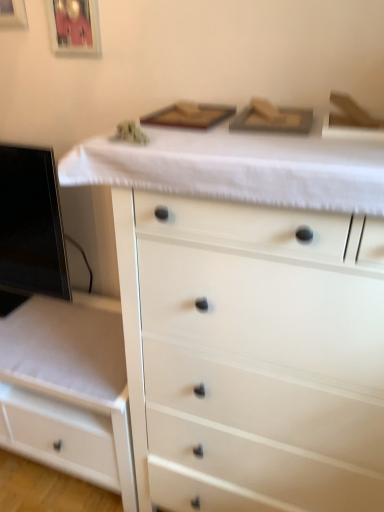
Question: From the image's perspective, is metallic silver picture frame at upper left, which appears as the 2th picture frame when viewed from the right, beneath white matte chest of drawers at center, which is counted as the 1th chest of drawers, starting from the right?

Choices:
 (A) yes
 (B) no

Answer: (B)

Question: Is metallic silver picture frame at upper left, the first picture frame when ordered from left to right, further to the viewer compared to white matte chest of drawers at center, the second chest of drawers when ordered from left to right?

Choices:
 (A) yes
 (B) no

Answer: (A)

Question: Is metallic silver picture frame at upper left, which appears as the 2th picture frame when viewed from the right, positioned with its back to white matte chest of drawers at center, which is counted as the 1th chest of drawers, starting from the right?

Choices:
 (A) yes
 (B) no

Answer: (B)

Question: Does metallic silver picture frame at upper left, which appears as the 2th picture frame when viewed from the right, appear on the right side of white matte chest of drawers at center, which is counted as the 1th chest of drawers, starting from the right?

Choices:
 (A) no
 (B) yes

Answer: (A)

Question: Is the surface of metallic silver picture frame at upper left, the first picture frame when ordered from left to right, in direct contact with white matte chest of drawers at center, which is counted as the 1th chest of drawers, starting from the right?

Choices:
 (A) no
 (B) yes

Answer: (A)

Question: Looking at the image, does white fabric at upper center seem bigger or smaller compared to white glossy drawer at lower left, which is the first chest of drawers from left to right?

Choices:
 (A) big
 (B) small

Answer: (B)

Question: Does point (104, 166) appear closer or farther from the camera than point (87, 464)?

Choices:
 (A) closer
 (B) farther

Answer: (A)

Question: Is white fabric at upper center inside the boundaries of white glossy drawer at lower left, which is the first chest of drawers from left to right, or outside?

Choices:
 (A) outside
 (B) inside

Answer: (A)

Question: Is white fabric at upper center wider or thinner than white glossy drawer at lower left, which is the first chest of drawers from left to right?

Choices:
 (A) thin
 (B) wide

Answer: (B)

Question: Based on their positions, is white matte chest of drawers at center, which is counted as the 1th chest of drawers, starting from the right, located to the left or right of black glossy computer monitor at left?

Choices:
 (A) left
 (B) right

Answer: (B)

Question: From a real-world perspective, relative to black glossy computer monitor at left, is white matte chest of drawers at center, which is counted as the 1th chest of drawers, starting from the right, vertically above or below?

Choices:
 (A) above
 (B) below

Answer: (B)

Question: In terms of width, does white matte chest of drawers at center, the second chest of drawers when ordered from left to right, look wider or thinner when compared to black glossy computer monitor at left?

Choices:
 (A) wide
 (B) thin

Answer: (A)

Question: Is white matte chest of drawers at center, which is counted as the 1th chest of drawers, starting from the right, spatially inside black glossy computer monitor at left, or outside of it?

Choices:
 (A) outside
 (B) inside

Answer: (A)

Question: Which is correct: white fabric at upper center is inside metallic silver picture frame at upper left, which appears as the 2th picture frame when viewed from the right, or outside of it?

Choices:
 (A) inside
 (B) outside

Answer: (B)

Question: In terms of height, does white fabric at upper center look taller or shorter compared to metallic silver picture frame at upper left, which appears as the 2th picture frame when viewed from the right?

Choices:
 (A) tall
 (B) short

Answer: (B)